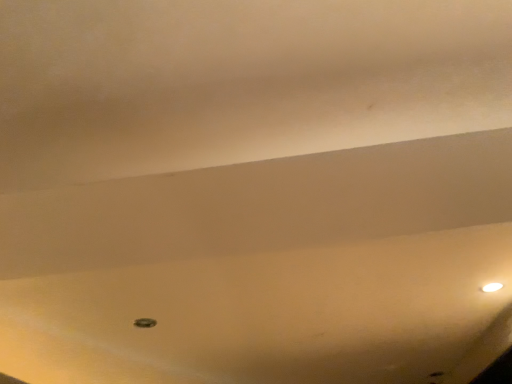
Question: Should I look upward or downward to see white glossy lamp at upper right?

Choices:
 (A) down
 (B) up

Answer: (A)